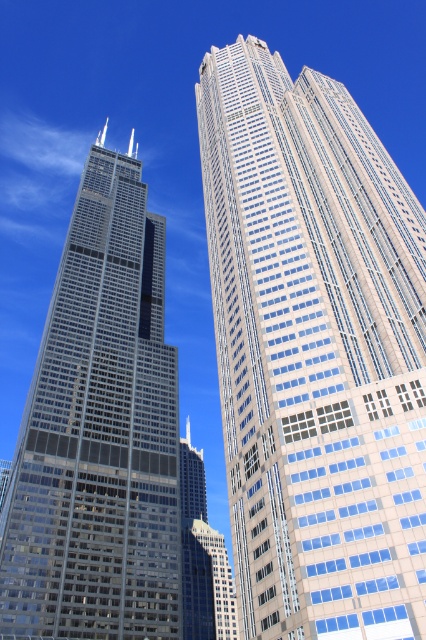
You are standing at the origin point of the coordinate system in the image. You want to locate the glassy steel skyscraper at center. What are its coordinates?

The glassy steel skyscraper at center is located at coordinates point (314, 352).

You are standing on the observation deck of the glassy steel skyscraper at left and want to take a photo of the glassy steel skyscraper at center. Which direction should you face to capture it in your shot?

You should face to the right to capture the glassy steel skyscraper at center, as it is located to the right of the glassy steel skyscraper at left.

You are standing in a plaza in front of the glassy steel skyscraper at center. You want to take a photo of it from a distance of 100 feet. Can you move closer to achieve this?

The glassy steel skyscraper at center is currently 120.86 feet away from you. Since you want to be 100 feet away, you need to move 20.86 feet closer to reach the desired distance.